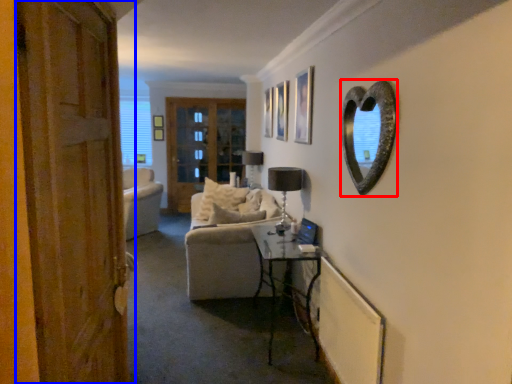
Question: Which point is closer to the camera, mirror (highlighted by a red box) or door (highlighted by a blue box)?

Choices:
 (A) mirror
 (B) door

Answer: (B)